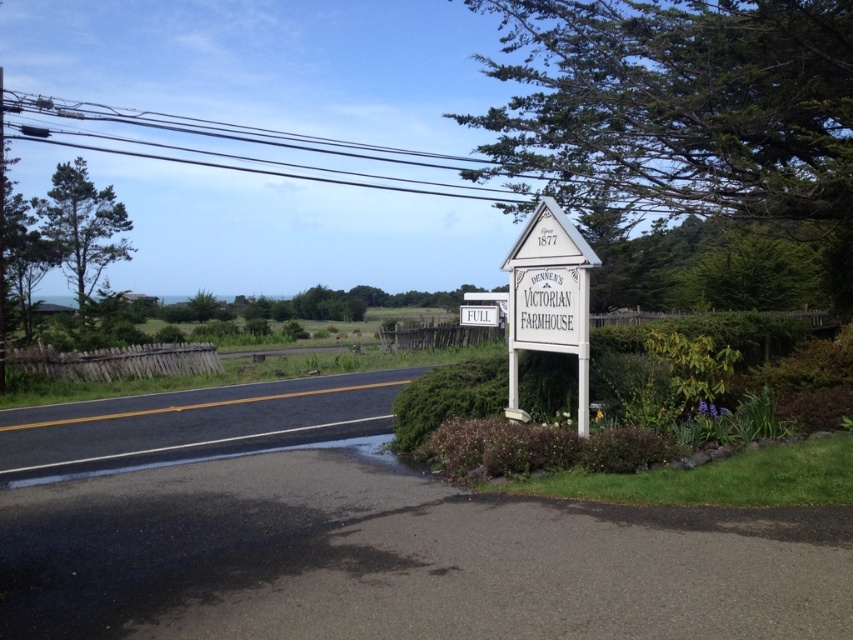
Question: Which of the following is the farthest from the observer?

Choices:
 (A) (482, 316)
 (B) (508, 292)

Answer: (A)

Question: Does white wooden sign at center come behind white matte sign at center?

Choices:
 (A) no
 (B) yes

Answer: (A)

Question: Does white wooden sign at center have a greater width compared to white matte sign at center?

Choices:
 (A) no
 (B) yes

Answer: (A)

Question: Can you confirm if white wooden sign at center is bigger than white matte sign at center?

Choices:
 (A) yes
 (B) no

Answer: (B)